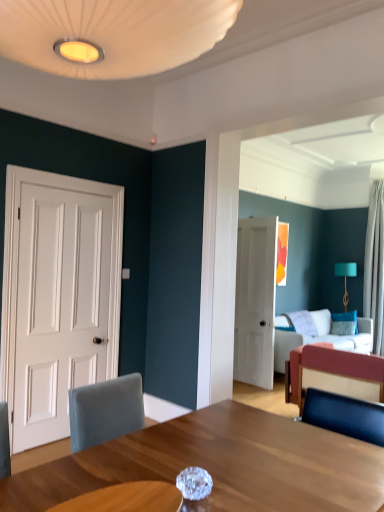
Question: Do you think white matte door at left, the 1th door viewed from the left, is within velvet red couch at right, or outside of it?

Choices:
 (A) inside
 (B) outside

Answer: (B)

Question: From the image's perspective, relative to velvet red couch at right, is white matte door at left, which ranks as the 1th door in front-to-back order, above or below?

Choices:
 (A) below
 (B) above

Answer: (B)

Question: Estimate the real-world distances between objects in this image. Which object is farther from the white matte door at left, placed as the 2th door when sorted from back to front?

Choices:
 (A) white matte door at center, the second door when ordered from left to right
 (B) velvet fabric couch at center
 (C) velvet red couch at right
 (D) white sheer curtain at right
 (E) teal fabric lampshade at upper right

Answer: (E)

Question: Which of these objects is positioned closest to the teal fabric lampshade at upper right?

Choices:
 (A) white sheer curtain at right
 (B) blue velvet pillow at upper right
 (C) white matte door at left, which ranks as the 1th door in front-to-back order
 (D) velvet red couch at right
 (E) white matte door at center, marked as the first door in a right-to-left arrangement

Answer: (B)